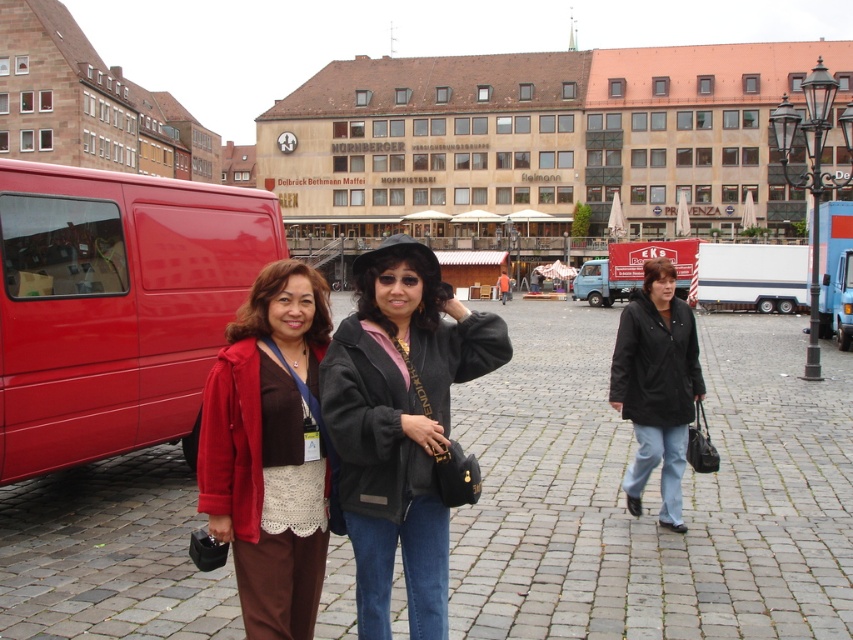
Question: Is matte brown pants at center to the left of black leather jacket at center from the viewer's perspective?

Choices:
 (A) no
 (B) yes

Answer: (B)

Question: Which point is farther from the camera taking this photo?

Choices:
 (A) (148, 241)
 (B) (631, 417)
 (C) (236, 522)

Answer: (A)

Question: Which point is farther to the camera?

Choices:
 (A) black fuzzy jacket at center
 (B) matte brown pants at center
 (C) matte red van at left
 (D) black leather jacket at center

Answer: (D)

Question: Can you confirm if matte red van at left is positioned to the left of black leather jacket at center?

Choices:
 (A) yes
 (B) no

Answer: (A)

Question: Can you confirm if matte brown pants at center is positioned below black leather jacket at center?

Choices:
 (A) no
 (B) yes

Answer: (A)

Question: Which object is farther from the camera taking this photo?

Choices:
 (A) matte brown pants at center
 (B) matte red van at left
 (C) black fuzzy jacket at center

Answer: (B)